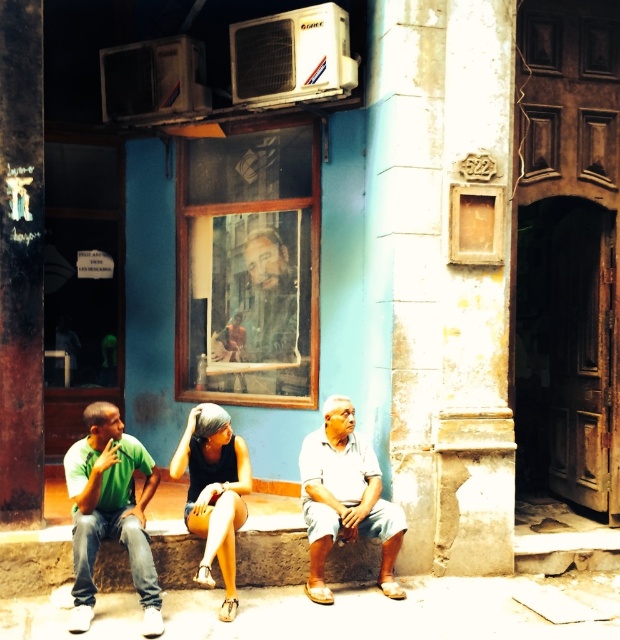
Question: Which of the following is the farthest from the observer?

Choices:
 (A) light blue cotton shorts at lower center
 (B) smooth wooden frame at center
 (C) green matte shirt at left
 (D) matte black tank top at center

Answer: (B)

Question: Is light blue cotton shorts at lower center positioned in front of smooth wooden frame at center?

Choices:
 (A) no
 (B) yes

Answer: (B)

Question: Can you confirm if green matte shirt at left is thinner than light blue cotton shorts at lower center?

Choices:
 (A) no
 (B) yes

Answer: (B)

Question: Which point is farther from the camera taking this photo?

Choices:
 (A) (151, 460)
 (B) (259, 360)
 (C) (342, 403)
 (D) (217, 468)

Answer: (B)

Question: Is light blue cotton shorts at lower center below smooth wooden frame at center?

Choices:
 (A) yes
 (B) no

Answer: (A)

Question: Among these points, which one is nearest to the camera?

Choices:
 (A) (396, 596)
 (B) (76, 568)

Answer: (B)